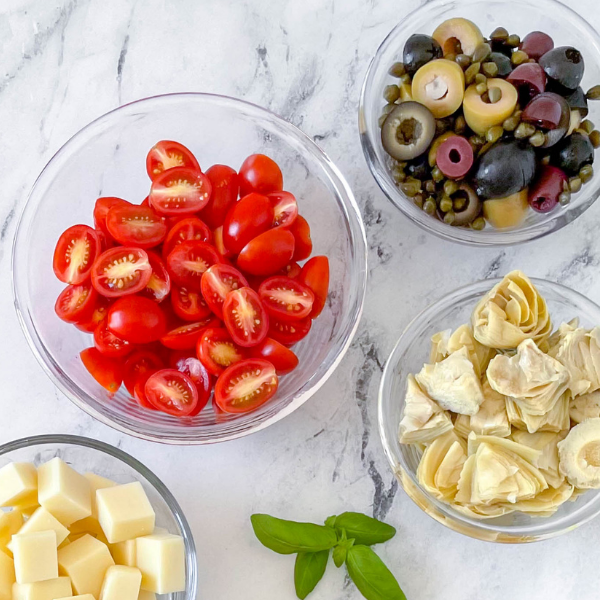
Locate an element on the screen. This screenshot has width=600, height=600. bowl is located at coordinates (171, 510).